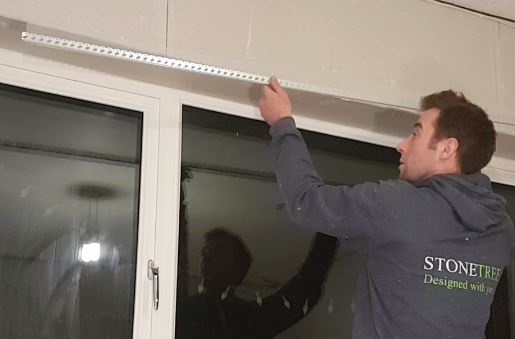
Identify the location of windows. The image size is (515, 339). (39, 122), (224, 151).